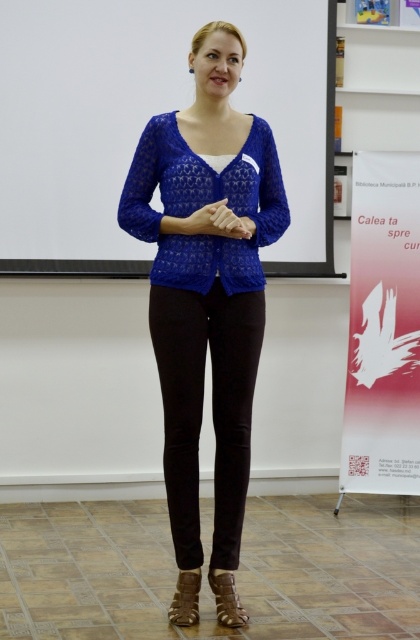
Question: Which point appears closest to the camera in this image?

Choices:
 (A) (236, 477)
 (B) (144, 3)

Answer: (A)

Question: Does white matte projection screen at center come behind lace fabric sweater at center?

Choices:
 (A) no
 (B) yes

Answer: (B)

Question: Can you confirm if white matte projection screen at center is positioned above lace fabric sweater at center?

Choices:
 (A) yes
 (B) no

Answer: (A)

Question: Does white matte projection screen at center appear on the right side of lace fabric sweater at center?

Choices:
 (A) yes
 (B) no

Answer: (B)

Question: Among these points, which one is farthest from the camera?

Choices:
 (A) (170, 280)
 (B) (134, 96)

Answer: (B)